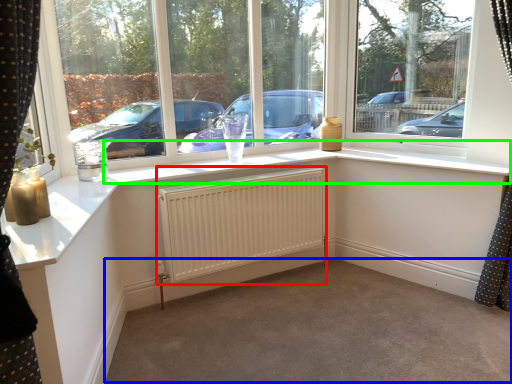
Question: Which object is positioned closest to radiator (highlighted by a red box)? Select from plain (highlighted by a blue box) and window sill (highlighted by a green box).

Choices:
 (A) plain
 (B) window sill

Answer: (B)